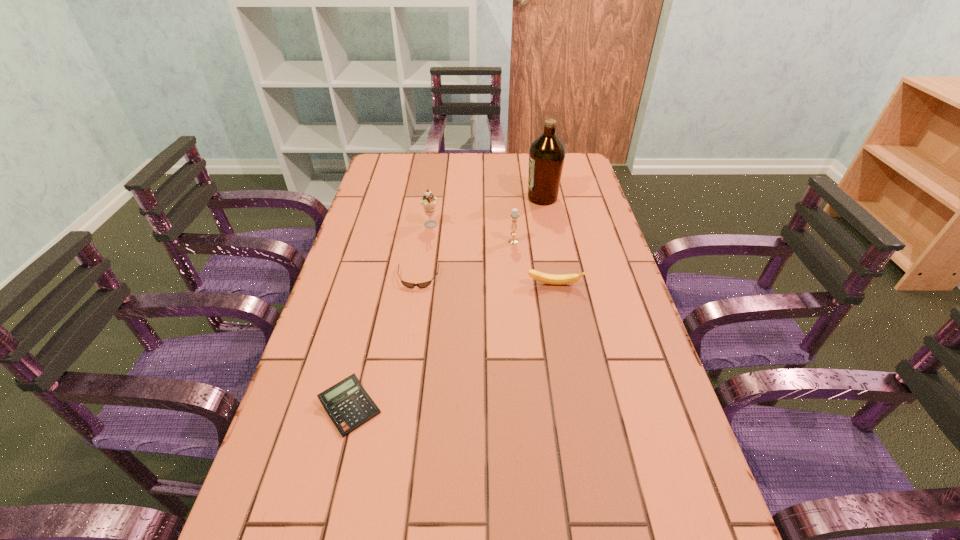
Locate an element on the screen. Image resolution: width=960 pixels, height=540 pixels. vacant space in between the sunglasses and the tallest object is located at coordinates (480, 238).

Find the location of a particular element. This screenshot has width=960, height=540. vacant area that lies between the third shortest object and the tallest object is located at coordinates (548, 241).

Identify the location of empty location between the banana and the tallest object. (548, 241).

Find the location of a particular element. Image resolution: width=960 pixels, height=540 pixels. free area in between the second farthest object and the banana is located at coordinates (492, 255).

The image size is (960, 540). In order to click on the fifth closest object to the nearest object in this screenshot , I will do `click(547, 153)`.

This screenshot has width=960, height=540. Find the location of `the third closest object to the banana`. the third closest object to the banana is located at coordinates (428, 201).

What are the coordinates of `free space that satisfies the following two spatial constraints: 1. on the label of the farthest object; 2. on the front side of the icecream` in the screenshot? It's located at (548, 226).